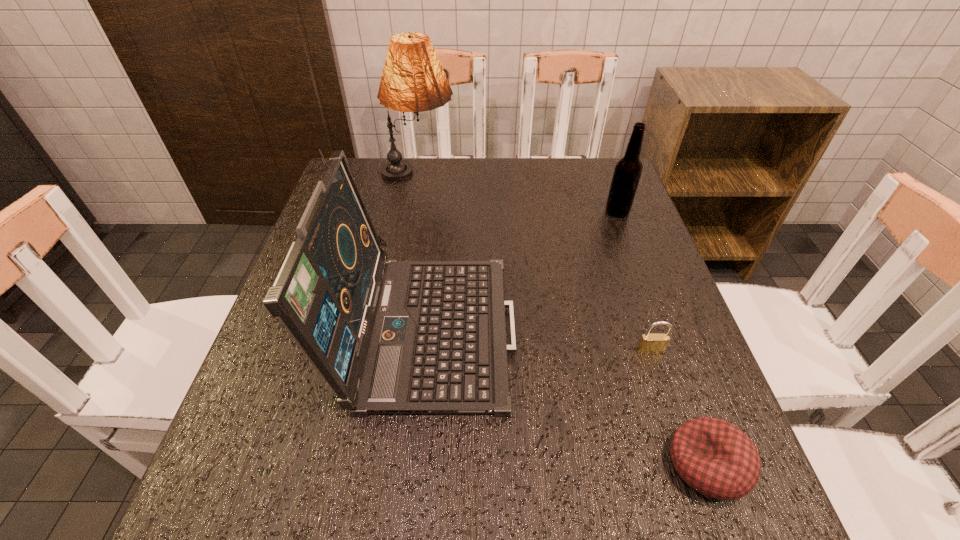
Locate an element on the screen. The image size is (960, 540). object located at the far left corner is located at coordinates (413, 80).

The height and width of the screenshot is (540, 960). In order to click on object situated at the near right corner in this screenshot , I will do `click(714, 457)`.

Find the location of a particular element. The height and width of the screenshot is (540, 960). vacant space at the far edge of the desktop is located at coordinates (443, 175).

Where is `free space at the left edge of the desktop`? This screenshot has width=960, height=540. free space at the left edge of the desktop is located at coordinates (248, 436).

Find the location of a particular element. vacant region at the right edge is located at coordinates (632, 227).

Where is `vacant space at the far left corner of the desktop`? Image resolution: width=960 pixels, height=540 pixels. vacant space at the far left corner of the desktop is located at coordinates (371, 159).

Locate an element on the screen. vacant space at the near left corner of the desktop is located at coordinates (290, 531).

Find the location of a particular element. vacant space that's between the laptop computer and the padlock is located at coordinates (539, 337).

Find the location of a particular element. Image resolution: width=960 pixels, height=540 pixels. vacant point located between the padlock and the beanbag is located at coordinates (679, 408).

The height and width of the screenshot is (540, 960). What are the coordinates of `free space between the second shortest object and the lampshade` in the screenshot? It's located at (535, 264).